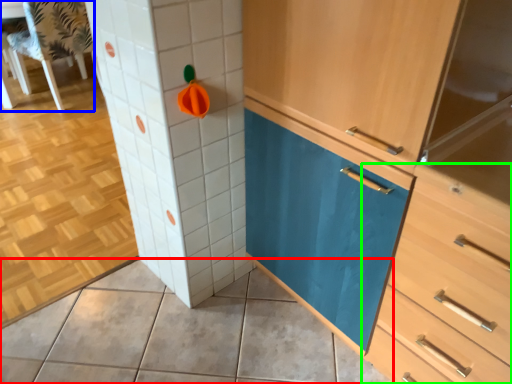
Question: Considering the real-world distances, which object is farthest from ceramic tile (highlighted by a red box)? chair (highlighted by a blue box) or chest of drawers (highlighted by a green box)?

Choices:
 (A) chair
 (B) chest of drawers

Answer: (A)